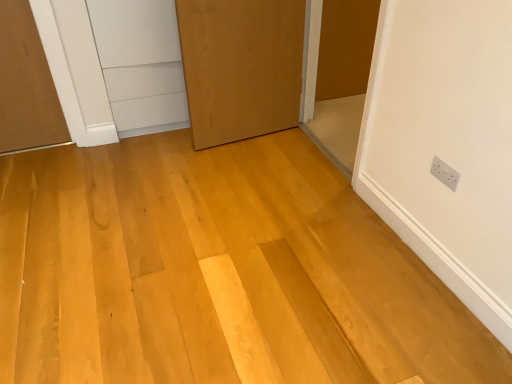
Question: Visually, is natural wood floor at center positioned to the left or to the right of matte brown door at upper right, which is counted as the first door, starting from the right?

Choices:
 (A) left
 (B) right

Answer: (A)

Question: From a real-world perspective, is natural wood floor at center physically located above or below matte brown door at upper right, which is the 2th door in left-to-right order?

Choices:
 (A) below
 (B) above

Answer: (A)

Question: Based on their relative distances, which object is farther from the matte brown door at upper right, which is counted as the first door, starting from the right?

Choices:
 (A) white plastic electric outlet at upper right
 (B) wooden door at center, arranged as the 2th door when viewed from the right
 (C) natural wood floor at center

Answer: (A)

Question: Which of these objects is positioned farthest from the natural wood floor at center?

Choices:
 (A) white plastic electric outlet at upper right
 (B) matte brown door at upper right, which is the 2th door in left-to-right order
 (C) wooden door at center, the 1th door when ordered from left to right

Answer: (B)